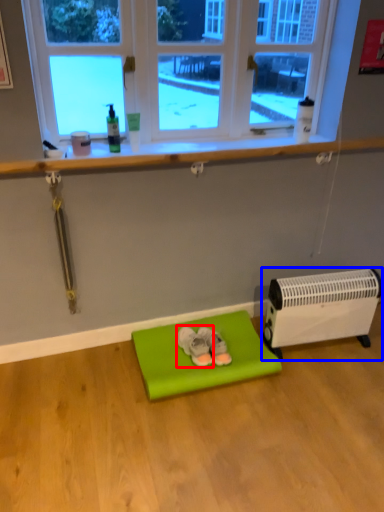
Question: Among these objects, which one is farthest to the camera, footwear (highlighted by a red box) or heater (highlighted by a blue box)?

Choices:
 (A) footwear
 (B) heater

Answer: (A)